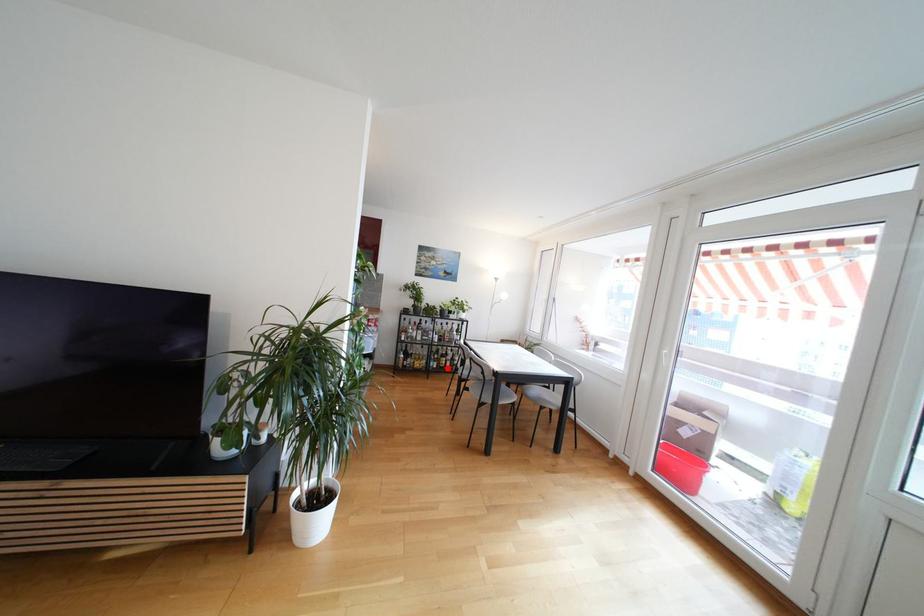
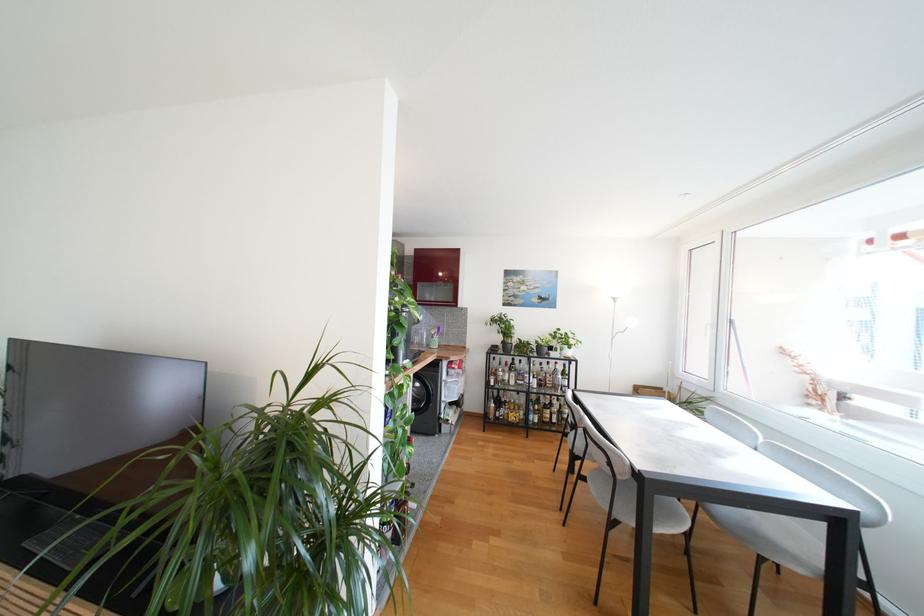
The point at the highlighted location is marked in the first image. Where is the corresponding point in the second image?

(553, 423)